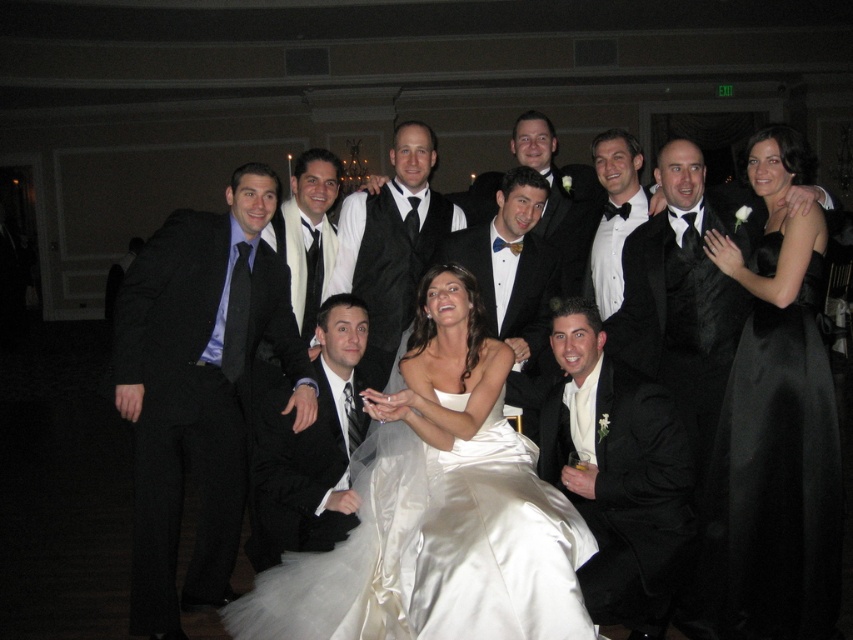
Does matte black suit at left have a greater width compared to black satin bow tie at center?

Correct, the width of matte black suit at left exceeds that of black satin bow tie at center.

Is point (202, 509) positioned before point (318, 252)?

Yes, it is.

The image size is (853, 640). Find the location of `matte black suit at left`. matte black suit at left is located at coordinates (199, 388).

Does satin black dress at upper right appear on the right side of matte black tuxedo at center?

Correct, you'll find satin black dress at upper right to the right of matte black tuxedo at center.

Locate an element on the screen. The image size is (853, 640). satin black dress at upper right is located at coordinates (775, 426).

Is point (735, 376) closer to viewer compared to point (523, 172)?

Yes.

The height and width of the screenshot is (640, 853). In order to click on satin black dress at upper right in this screenshot , I will do `click(775, 426)`.

Is shiny black suit at center to the left of shiny black vest at center from the viewer's perspective?

Yes, shiny black suit at center is to the left of shiny black vest at center.

Is point (323, 515) farther from viewer compared to point (384, 342)?

No.

This screenshot has width=853, height=640. What are the coordinates of `shiny black suit at center` in the screenshot? It's located at (309, 444).